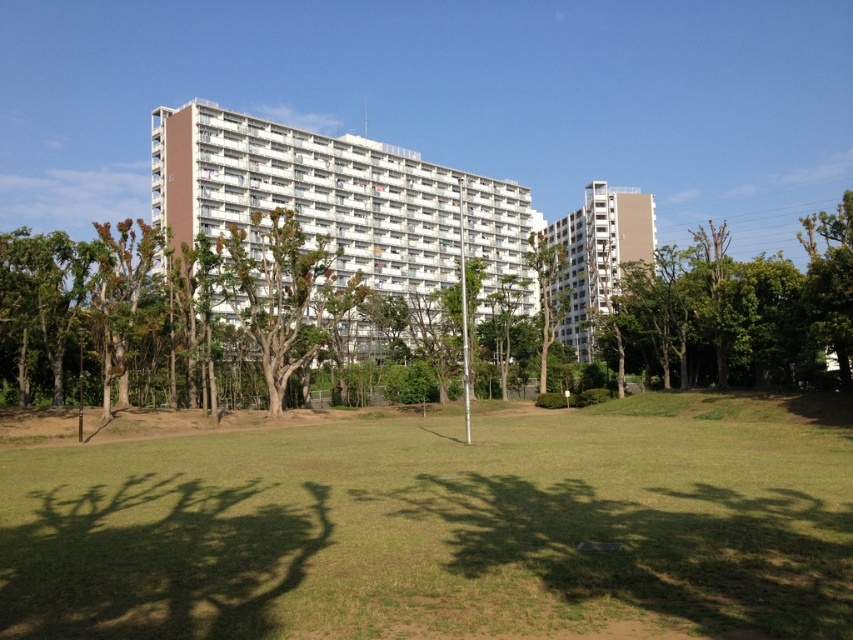
You are standing in the residential apartment complex and want to find a spot where the green grass at center and the green leafy tree at right are both visible. Which area should you look towards?

You should look towards the right side of the scene because the green leafy tree at right occupies more space than the green grass at center, making it more visible from that direction.